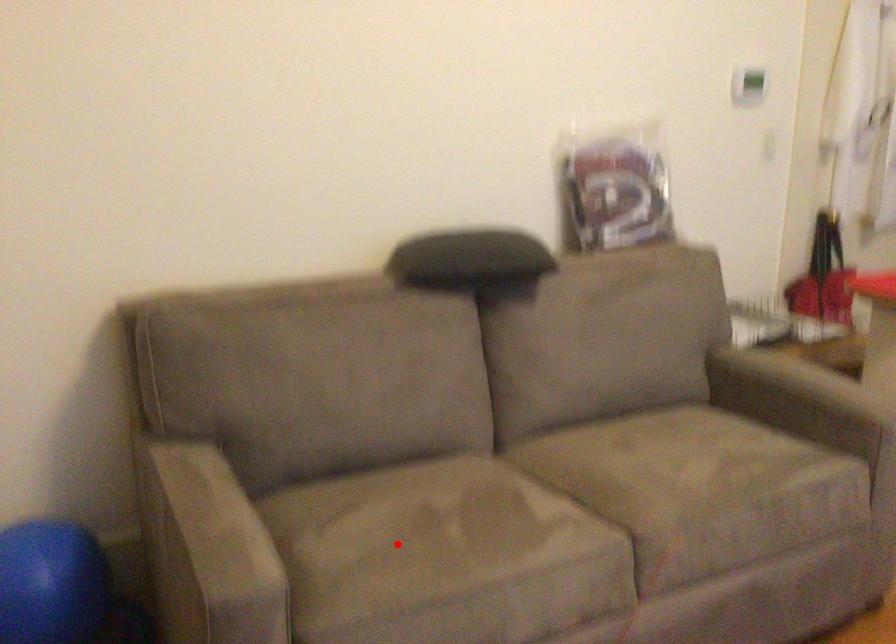
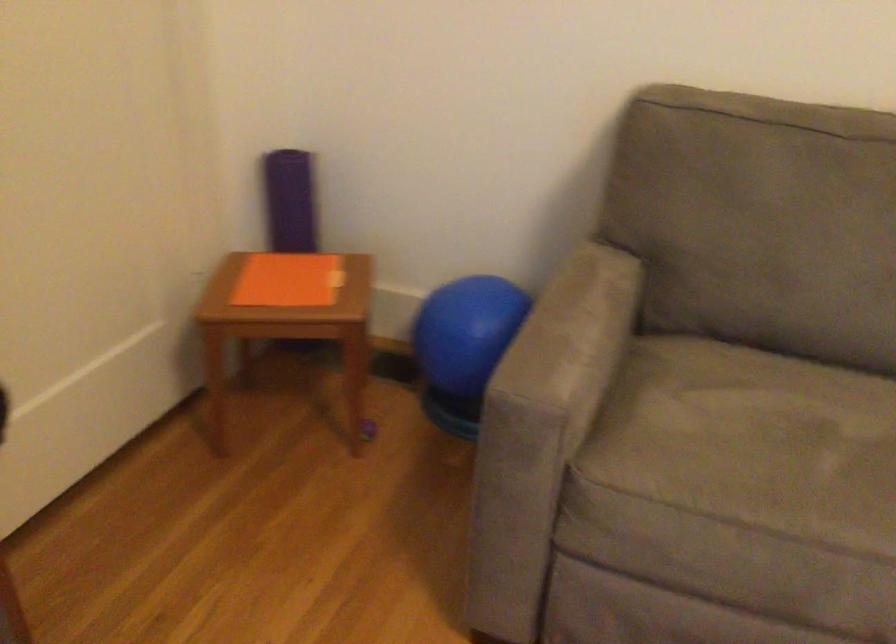
In the second image, find the point that corresponds to the highlighted location in the first image.

(752, 442)